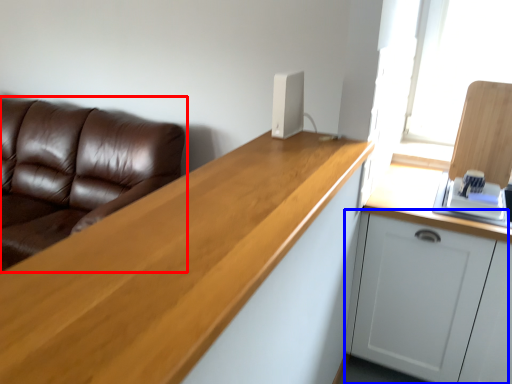
Question: Among these objects, which one is farthest to the camera, studio couch (highlighted by a red box) or cabinetry (highlighted by a blue box)?

Choices:
 (A) studio couch
 (B) cabinetry

Answer: (A)